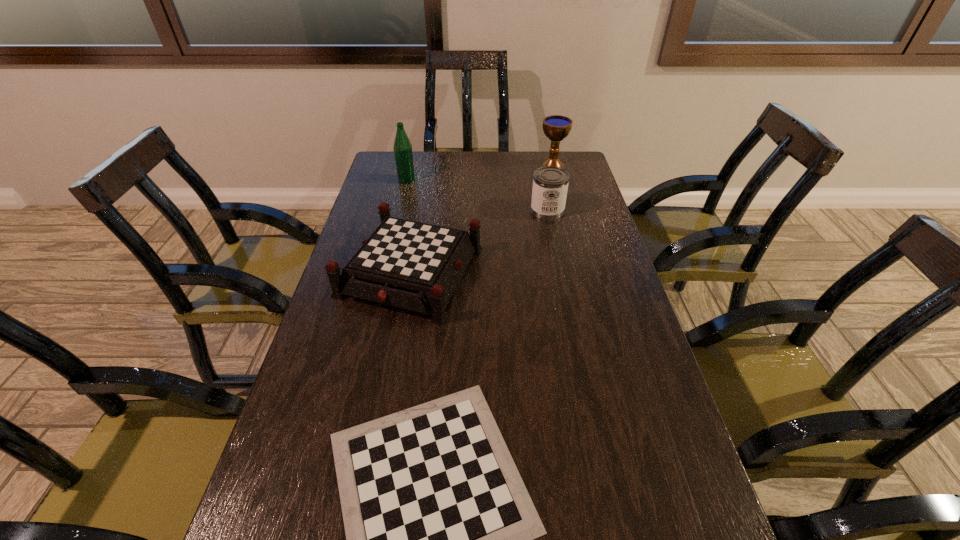
At what (x,y) coordinates should I click in order to perform the action: click on vacant point at the left edge. Please return your answer as a coordinate pair (x, y). This screenshot has width=960, height=540. Looking at the image, I should click on (379, 333).

The width and height of the screenshot is (960, 540). In order to click on free space at the right edge of the desktop in this screenshot , I will do `click(612, 484)`.

Locate an element on the screen. vacant area that lies between the chalice and the bottle is located at coordinates (480, 172).

Where is `vacant point located between the fourth shortest object and the checkerboard`? vacant point located between the fourth shortest object and the checkerboard is located at coordinates (482, 218).

Locate an element on the screen. vacant space in between the chalice and the bottle is located at coordinates (480, 172).

The height and width of the screenshot is (540, 960). I want to click on object that ranks as the second closest to the chessboard, so click(x=550, y=184).

At what (x,y) coordinates should I click in order to perform the action: click on object that is the second nearest to the chalice. Please return your answer as a coordinate pair (x, y). The height and width of the screenshot is (540, 960). Looking at the image, I should click on (412, 265).

Identify the location of free spot that satisfies the following two spatial constraints: 1. on the back side of the fourth tallest object; 2. on the right side of the third farthest object. [422, 210].

In order to click on vacant point that satisfies the following two spatial constraints: 1. on the back side of the second tallest object; 2. on the right side of the checkerboard in this screenshot , I will do `click(430, 165)`.